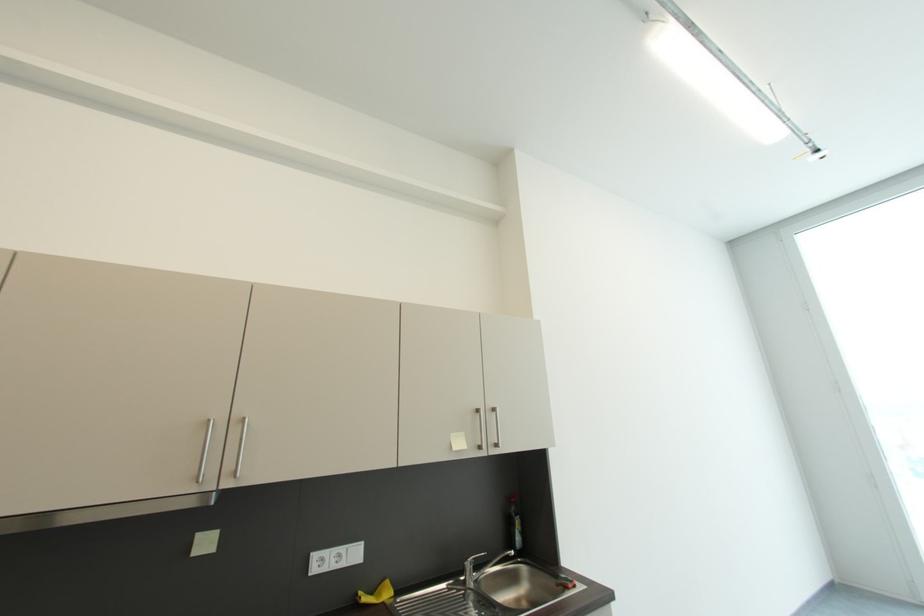
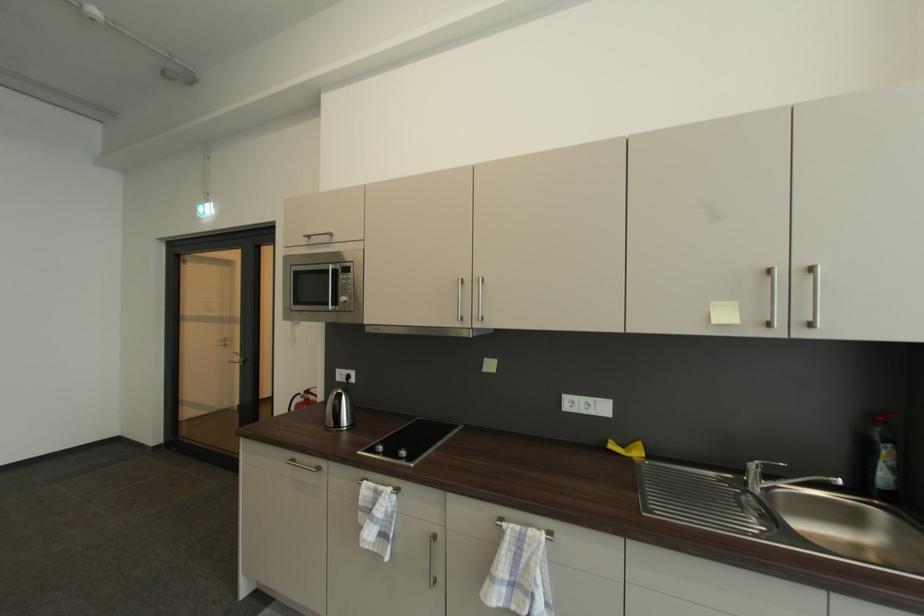
Find the pixel in the second image that matches (x=480, y=561) in the first image.

(769, 466)